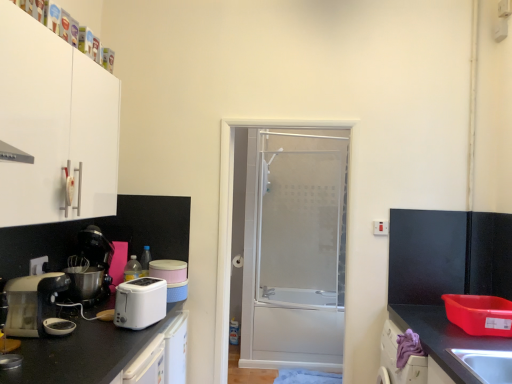
Question: Considering the relative sizes of purple fabric at lower right and black granite countertop at lower right, arranged as the 2th countertop when viewed from the left, in the image provided, is purple fabric at lower right bigger than black granite countertop at lower right, arranged as the 2th countertop when viewed from the left,?

Choices:
 (A) no
 (B) yes

Answer: (A)

Question: From a real-world perspective, is purple fabric at lower right positioned over black granite countertop at lower right, arranged as the first countertop when viewed from the right, based on gravity?

Choices:
 (A) yes
 (B) no

Answer: (A)

Question: Is purple fabric at lower right looking in the opposite direction of black granite countertop at lower right, arranged as the 2th countertop when viewed from the left?

Choices:
 (A) yes
 (B) no

Answer: (A)

Question: Is purple fabric at lower right at the left side of black granite countertop at lower right, arranged as the 2th countertop when viewed from the left?

Choices:
 (A) yes
 (B) no

Answer: (A)

Question: Is purple fabric at lower right shorter than black granite countertop at lower right, arranged as the 2th countertop when viewed from the left?

Choices:
 (A) yes
 (B) no

Answer: (A)

Question: Is white plastic toaster at lower left situated inside white plastic electric outlet at lower left or outside?

Choices:
 (A) inside
 (B) outside

Answer: (B)

Question: Considering the positions of white plastic toaster at lower left and white plastic electric outlet at lower left in the image, is white plastic toaster at lower left bigger or smaller than white plastic electric outlet at lower left?

Choices:
 (A) big
 (B) small

Answer: (A)

Question: Looking at their shapes, would you say white plastic toaster at lower left is wider or thinner than white plastic electric outlet at lower left?

Choices:
 (A) wide
 (B) thin

Answer: (A)

Question: Is white plastic toaster at lower left to the left or to the right of white plastic electric outlet at lower left in the image?

Choices:
 (A) left
 (B) right

Answer: (B)

Question: Is white plastic toaster at lower left to the left or to the right of matte white toaster at left in the image?

Choices:
 (A) left
 (B) right

Answer: (B)

Question: Which is correct: white plastic toaster at lower left is inside matte white toaster at left, or outside of it?

Choices:
 (A) outside
 (B) inside

Answer: (A)

Question: From the image's perspective, is white plastic toaster at lower left positioned above or below matte white toaster at left?

Choices:
 (A) below
 (B) above

Answer: (A)

Question: Is white plastic toaster at lower left taller or shorter than matte white toaster at left?

Choices:
 (A) short
 (B) tall

Answer: (A)

Question: Is purple fabric at lower right taller or shorter than matte white toaster at left?

Choices:
 (A) short
 (B) tall

Answer: (A)

Question: Is purple fabric at lower right wider or thinner than matte white toaster at left?

Choices:
 (A) thin
 (B) wide

Answer: (A)